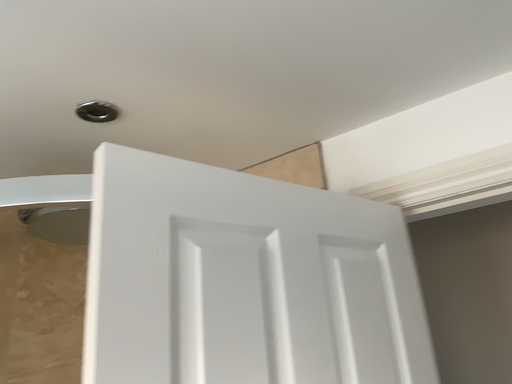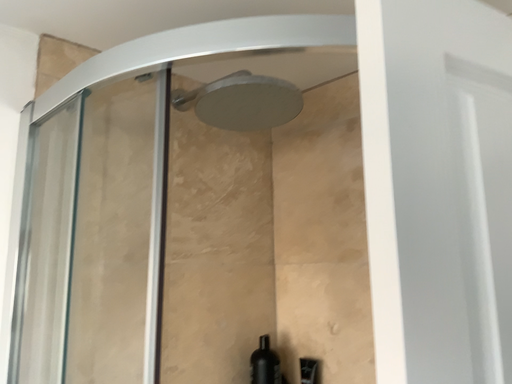
Question: Which way did the camera rotate in the video?

Choices:
 (A) rotated downward
 (B) rotated upward

Answer: (A)